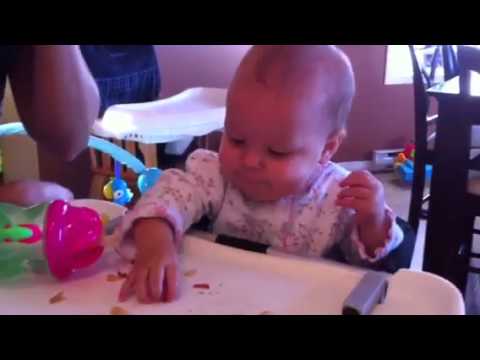
Where is `toys`? The image size is (480, 360). toys is located at coordinates (406, 165), (118, 189), (117, 152).